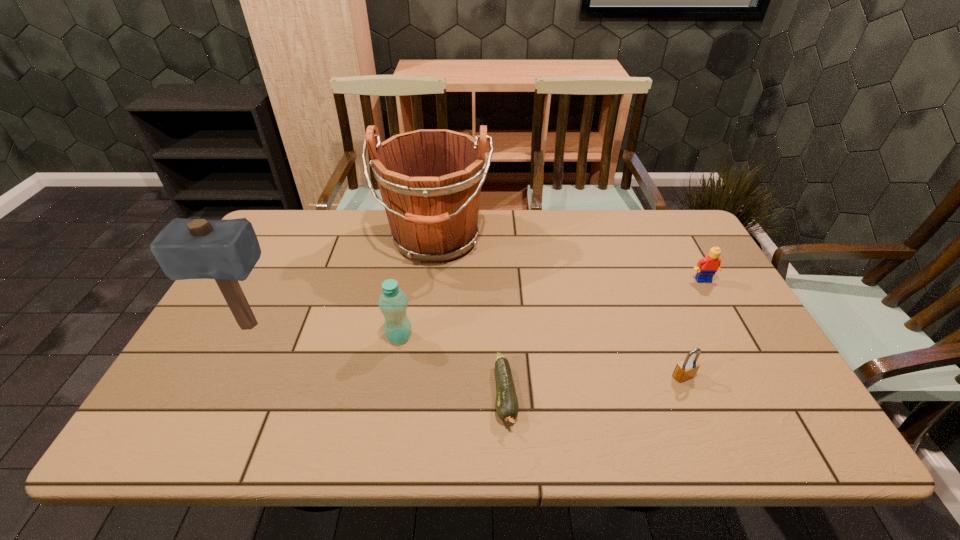
What are the coordinates of `vacant area located on the right of the third tallest object` in the screenshot? It's located at (471, 337).

At what (x,y) coordinates should I click in order to perform the action: click on vacant region located on the face of the third shortest object. Please return your answer as a coordinate pair (x, y). Looking at the image, I should click on (749, 361).

In order to click on vacant position located on the back of the fifth tallest object in this screenshot , I will do `click(663, 328)`.

The width and height of the screenshot is (960, 540). I want to click on object situated at the far edge, so click(x=430, y=180).

Identify the location of object positioned at the near edge. This screenshot has width=960, height=540. (507, 407).

Find the location of a particular element. The height and width of the screenshot is (540, 960). object located in the left edge section of the desktop is located at coordinates (227, 250).

Find the location of a particular element. The height and width of the screenshot is (540, 960). object at the right edge is located at coordinates (706, 268).

In the image, there is a desktop. What are the coordinates of `free space at the far edge` in the screenshot? It's located at (529, 223).

This screenshot has height=540, width=960. Identify the location of free space at the near edge. (690, 435).

The height and width of the screenshot is (540, 960). I want to click on vacant space at the left edge of the desktop, so click(253, 293).